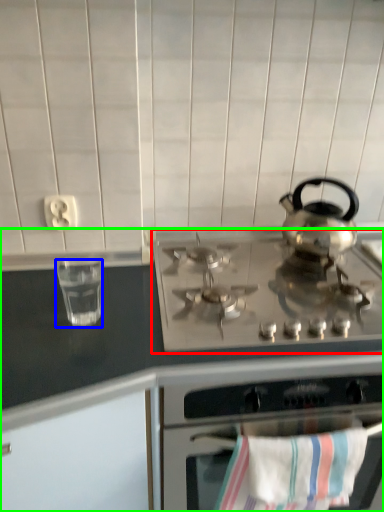
Question: Considering the real-world distances, which object is farthest from gas stove (highlighted by a red box)? appliance (highlighted by a blue box) or countertop (highlighted by a green box)?

Choices:
 (A) appliance
 (B) countertop

Answer: (A)